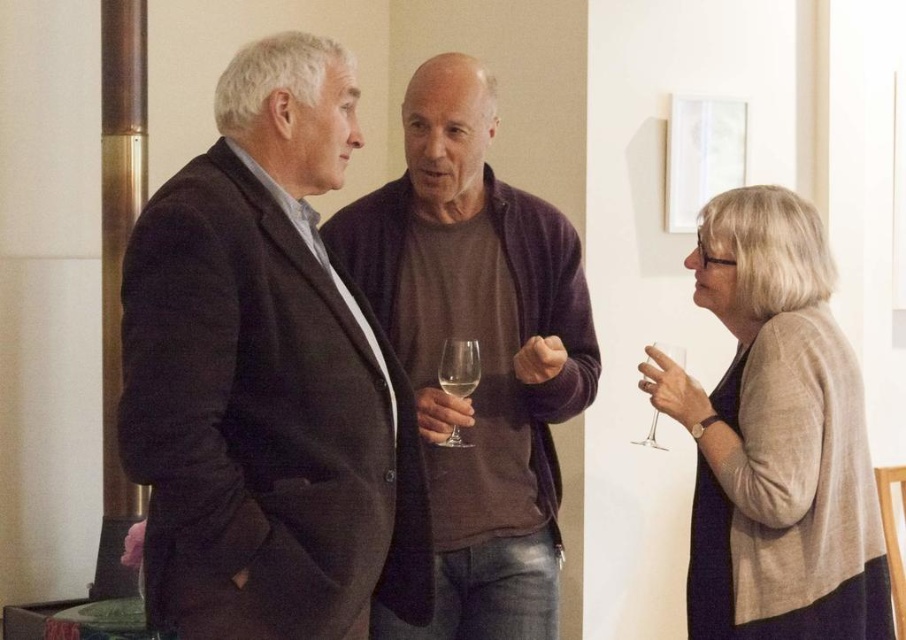
Question: Which object is the closest to the clear glass at center?

Choices:
 (A) brown cotton sweater at center
 (B) clear glass wine glass at center

Answer: (B)

Question: Estimate the real-world distances between objects in this image. Which object is farther from the clear glass wine glass at center?

Choices:
 (A) dark brown suit at center
 (B) brown cotton sweater at center

Answer: (A)

Question: Can you confirm if brown cotton sweater at center is positioned above clear glass wine glass at center?

Choices:
 (A) no
 (B) yes

Answer: (B)

Question: Which point is farther from the camera taking this photo?

Choices:
 (A) click(858, 404)
 (B) click(476, 346)

Answer: (A)

Question: Is clear glass wine glass at center bigger than clear glass wine glass at lower right?

Choices:
 (A) yes
 (B) no

Answer: (B)

Question: Is brown cotton sweater at center above clear glass wine glass at center?

Choices:
 (A) no
 (B) yes

Answer: (B)